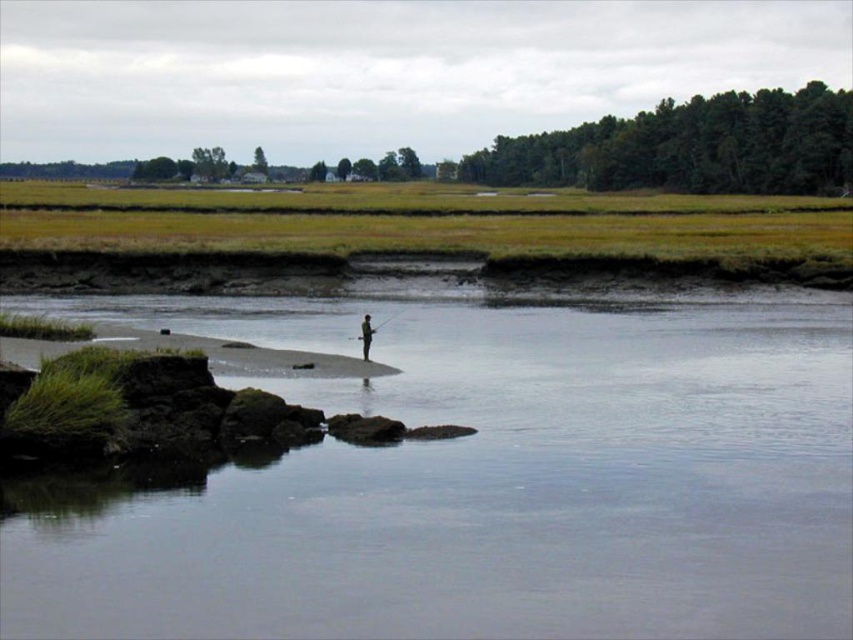
Question: Is clear water at center closer to the viewer compared to light brown wooden pole at center?

Choices:
 (A) no
 (B) yes

Answer: (B)

Question: Is clear water at center positioned behind light brown wooden pole at center?

Choices:
 (A) yes
 (B) no

Answer: (B)

Question: Which point appears closest to the camera in this image?

Choices:
 (A) (368, 321)
 (B) (795, 458)

Answer: (B)

Question: Which point is closer to the camera taking this photo?

Choices:
 (A) click(x=547, y=416)
 (B) click(x=363, y=337)

Answer: (A)

Question: Is clear water at center smaller than light brown wooden pole at center?

Choices:
 (A) yes
 (B) no

Answer: (B)